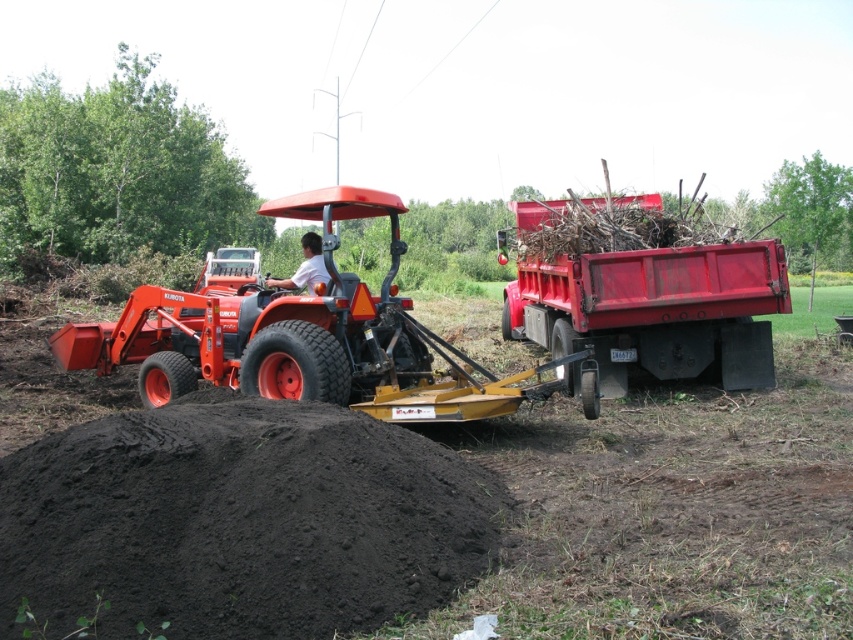
Does black soil at lower left have a lesser height compared to matte orange tractor at center?

Incorrect, black soil at lower left's height does not fall short of matte orange tractor at center's.

Does black soil at lower left come behind matte orange tractor at center?

No.

Is point (230, 529) in front of point (399, 406)?

Yes, point (230, 529) is in front of point (399, 406).

Where is `black soil at lower left`? The width and height of the screenshot is (853, 640). black soil at lower left is located at coordinates (239, 520).

Can you confirm if black soil at lower left is positioned to the left of red matte trailer truck at right?

Indeed, black soil at lower left is positioned on the left side of red matte trailer truck at right.

Which is more to the left, black soil at lower left or red matte trailer truck at right?

Positioned to the left is black soil at lower left.

The width and height of the screenshot is (853, 640). Identify the location of black soil at lower left. (239, 520).

The height and width of the screenshot is (640, 853). I want to click on black soil at lower left, so click(x=239, y=520).

Does matte orange tractor at center have a smaller size compared to white matte shirt at center?

Yes.

At what (x,y) coordinates should I click in order to perform the action: click on matte orange tractor at center. Please return your answer as a coordinate pair (x, y). The image size is (853, 640). Looking at the image, I should click on (300, 337).

The width and height of the screenshot is (853, 640). What do you see at coordinates (300, 337) in the screenshot? I see `matte orange tractor at center` at bounding box center [300, 337].

You are a GUI agent. You are given a task and a screenshot of the screen. Output one action in this format:
    pyautogui.click(x=<x>, y=<y>)
    Task: Click on the matte orange tractor at center
    This screenshot has width=853, height=640.
    Given the screenshot: What is the action you would take?
    pyautogui.click(x=300, y=337)